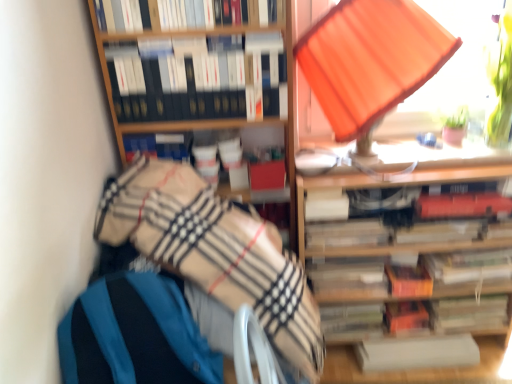
Question: From the image's perspective, does white paper at lower right, the 1th book from the back, appear higher than orange fabric lampshade at upper right?

Choices:
 (A) yes
 (B) no

Answer: (B)

Question: Is white paper at lower right, the 1th book from the back, closer to camera compared to orange fabric lampshade at upper right?

Choices:
 (A) no
 (B) yes

Answer: (A)

Question: Can you confirm if white paper at lower right, which is the fourth book in top-to-bottom order, is positioned to the left of orange fabric lampshade at upper right?

Choices:
 (A) no
 (B) yes

Answer: (A)

Question: Is white paper at lower right, the 4th book viewed from the front, thinner than orange fabric lampshade at upper right?

Choices:
 (A) yes
 (B) no

Answer: (A)

Question: Is white paper at lower right, marked as the 1th book in a bottom-to-top arrangement, taller than orange fabric lampshade at upper right?

Choices:
 (A) yes
 (B) no

Answer: (B)

Question: Considering the positions of point (343, 182) and point (435, 322), is point (343, 182) closer or farther from the camera than point (435, 322)?

Choices:
 (A) closer
 (B) farther

Answer: (A)

Question: From the image's perspective, is wooden bookshelf at upper right positioned above or below hardcover book at center, which is the 7th paperback book from top to bottom?

Choices:
 (A) above
 (B) below

Answer: (A)

Question: In terms of height, does wooden bookshelf at upper right look taller or shorter compared to hardcover book at center, the 3th paperback book positioned from the bottom?

Choices:
 (A) short
 (B) tall

Answer: (B)

Question: In terms of width, does wooden bookshelf at upper right look wider or thinner when compared to hardcover book at center, which is the 7th paperback book from top to bottom?

Choices:
 (A) thin
 (B) wide

Answer: (B)

Question: Relative to hardcover book at center, which is counted as the 2th book, starting from the back, is white paper at center, acting as the 8th paperback book starting from the bottom, in front or behind?

Choices:
 (A) behind
 (B) front

Answer: (B)

Question: Is white paper at center, acting as the 8th paperback book starting from the bottom, inside or outside of hardcover book at center, which is the 3th book in front-to-back order?

Choices:
 (A) inside
 (B) outside

Answer: (B)

Question: Based on their positions, is white paper at center, the 2th paperback book positioned from the top, located to the left or right of hardcover book at center, the second book in the bottom-to-top sequence?

Choices:
 (A) right
 (B) left

Answer: (B)

Question: From the image's perspective, is white paper at center, acting as the 8th paperback book starting from the bottom, located above or below hardcover book at center, the 3th book from the top?

Choices:
 (A) below
 (B) above

Answer: (B)

Question: Is hardcover books at upper center, marked as the 4th book in a back-to-front arrangement, in front of or behind beige plaid blanket at lower left in the image?

Choices:
 (A) front
 (B) behind

Answer: (B)

Question: Choose the correct answer: Is hardcover books at upper center, positioned as the 1th book in top-to-bottom order, inside beige plaid blanket at lower left or outside it?

Choices:
 (A) inside
 (B) outside

Answer: (B)